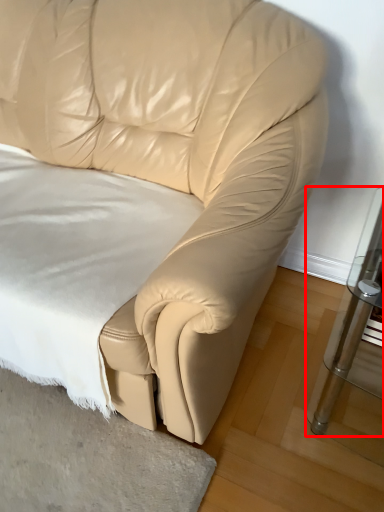
Question: Observing the image, what is the correct spatial positioning of table (annotated by the red box) in reference to sheet?

Choices:
 (A) left
 (B) right

Answer: (B)